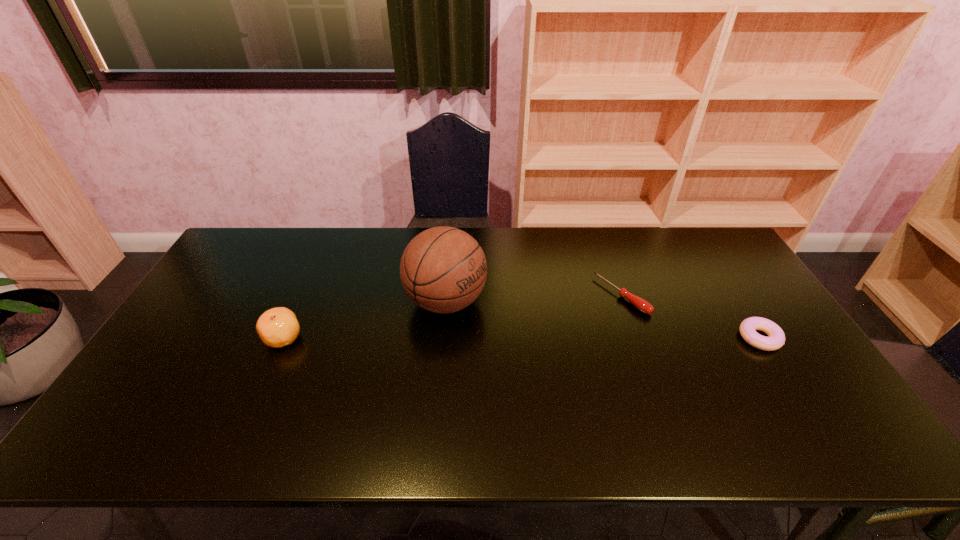
Locate an element on the screen. vacant point located between the second object from left to right and the second object from right to left is located at coordinates (534, 299).

Identify which object is the second closest to the tallest object. Please provide its 2D coordinates. Your answer should be formatted as a tuple, i.e. [(x, y)], where the tuple contains the x and y coordinates of a point satisfying the conditions above.

[(641, 304)]

Locate which object is the third closest to the clementine. Please provide its 2D coordinates. Your answer should be formatted as a tuple, i.e. [(x, y)], where the tuple contains the x and y coordinates of a point satisfying the conditions above.

[(776, 339)]

Locate an element on the screen. The image size is (960, 540). vacant position in the image that satisfies the following two spatial constraints: 1. on the front side of the third object from left to right; 2. on the right side of the doughnut is located at coordinates (636, 338).